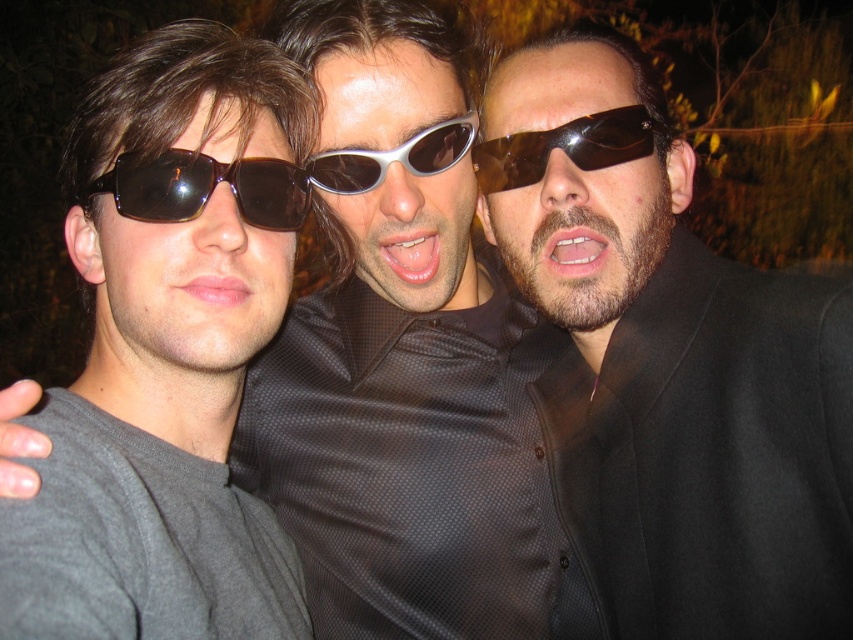
You are standing in front of the three people in the image. You want to touch the point at coordinates point (537, 152) and point (436, 129). Which point should you reach for first to touch the one closer to you?

You should reach for point (537, 152) first because it is closer to you than point (436, 129).

You are a photographer adjusting your camera settings in the dark. You notice two pairs of sunglasses in the scene. Which pair of sunglasses, the matte black sunglasses at left or the silver metallic sunglasses at center, is closer to the camera?

The matte black sunglasses at left is taller than the silver metallic sunglasses at center, so it is closer to the camera.